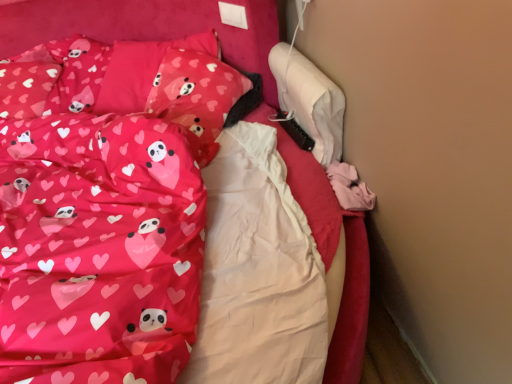
Question: Is matte pink pillow with heart and panda design at upper left, arranged as the second pillow when viewed from the back, taller or shorter than matte pink fabric bed at center?

Choices:
 (A) tall
 (B) short

Answer: (B)

Question: Is matte pink pillow with heart and panda design at upper left, arranged as the second pillow when viewed from the back, bigger or smaller than matte pink fabric bed at center?

Choices:
 (A) small
 (B) big

Answer: (A)

Question: Which is nearer to the matte pink pillow at upper left, the 1th pillow in the back-to-front sequence?

Choices:
 (A) matte pink fabric bed at center
 (B) matte pink fabric at left
 (C) matte pink pillow with heart and panda design at upper left, which is the first pillow in front-to-back order

Answer: (C)

Question: Which of these objects is positioned farthest from the matte pink pillow with heart and panda design at upper left, arranged as the second pillow when viewed from the back?

Choices:
 (A) matte pink fabric at left
 (B) matte pink pillow at upper left, marked as the second pillow in a front-to-back arrangement
 (C) matte pink fabric bed at center

Answer: (A)